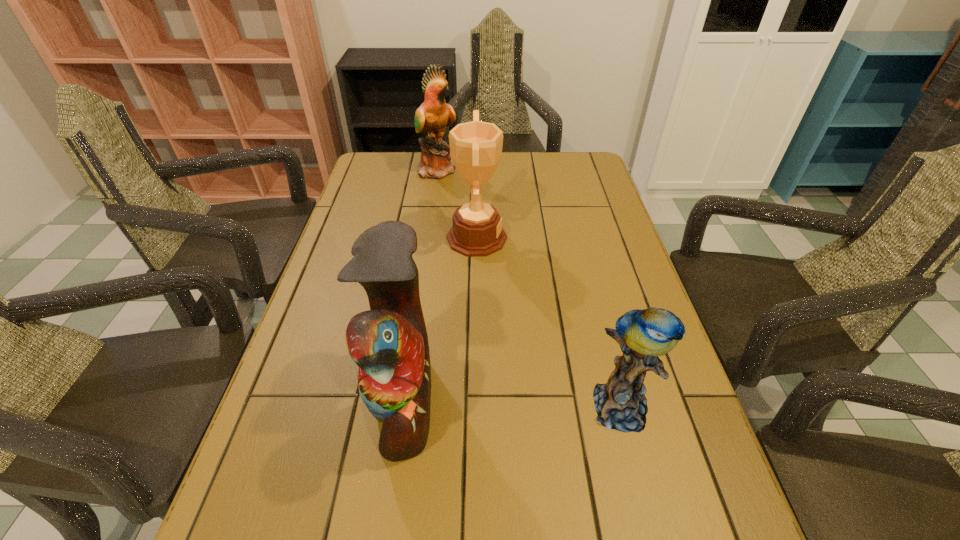
Where is `free spot at the right edge of the desktop`? Image resolution: width=960 pixels, height=540 pixels. free spot at the right edge of the desktop is located at coordinates (612, 204).

In the image, there is a desktop. Where is `vacant space at the far left corner`? Image resolution: width=960 pixels, height=540 pixels. vacant space at the far left corner is located at coordinates (390, 166).

This screenshot has width=960, height=540. In order to click on unoccupied position between the third nearest object and the rightmost parrot in this screenshot , I will do `click(548, 322)`.

Where is `blank region between the rightmost object and the farthest object`? The image size is (960, 540). blank region between the rightmost object and the farthest object is located at coordinates (529, 288).

The image size is (960, 540). Identify the location of unoccupied area between the farthest object and the rightmost object. (529, 288).

Locate an element on the screen. The height and width of the screenshot is (540, 960). vacant space that is in between the rightmost object and the third nearest object is located at coordinates (548, 322).

Locate an element on the screen. The image size is (960, 540). free space between the rightmost parrot and the award is located at coordinates (548, 322).

Locate which object ranks second in proximity to the rightmost parrot. Please provide its 2D coordinates. Your answer should be formatted as a tuple, i.e. [(x, y)], where the tuple contains the x and y coordinates of a point satisfying the conditions above.

[(476, 147)]

The width and height of the screenshot is (960, 540). I want to click on object that is the second nearest to the rightmost object, so click(x=476, y=147).

Find the location of `the closest parrot relative to the rightmost object`. the closest parrot relative to the rightmost object is located at coordinates (389, 343).